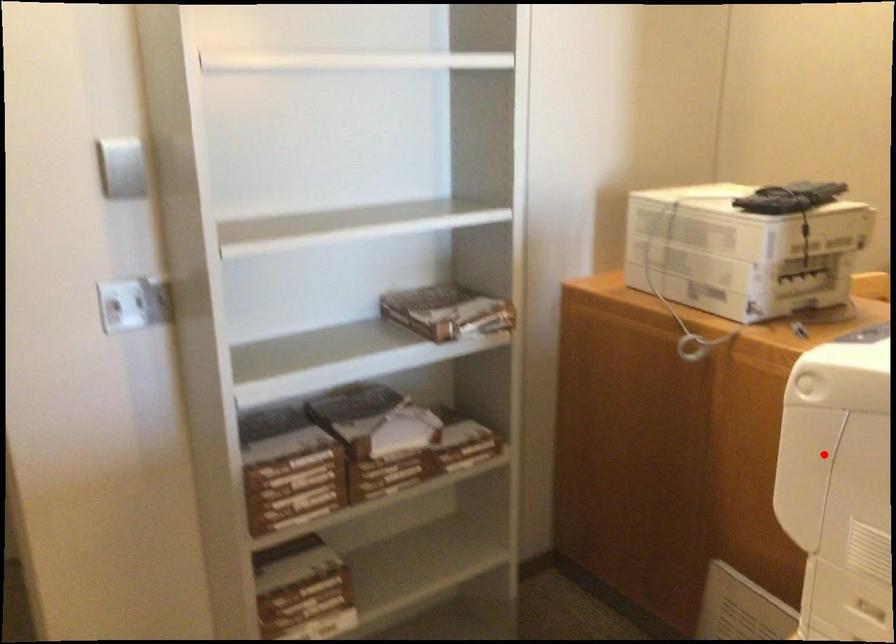
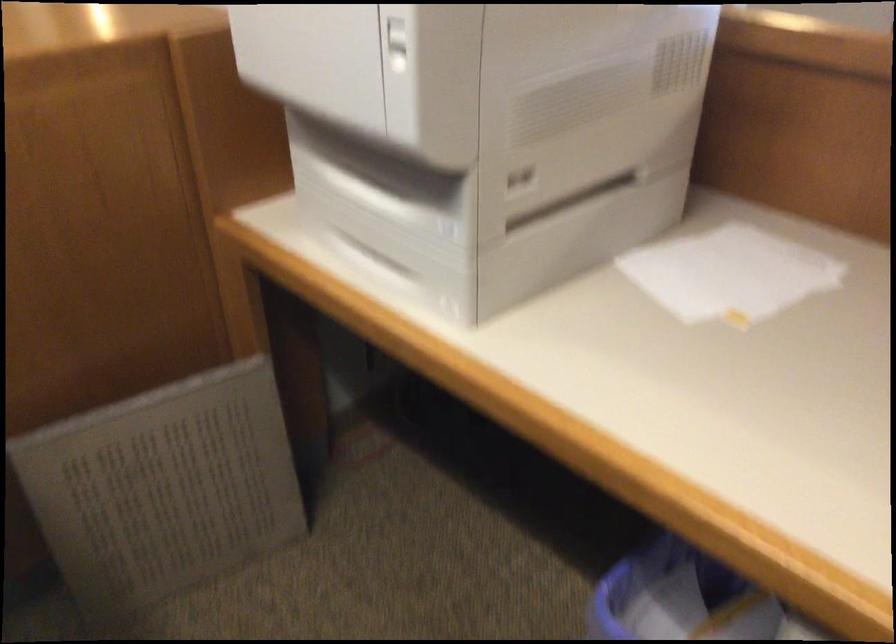
Question: I am providing you with two images of the same scene from different viewpoints. Image1 has a red point marked. In image2, the corresponding 3D location appears at what relative position? Reply with the corresponding letter.

Choices:
 (A) Closer
 (B) Farther

Answer: (A)